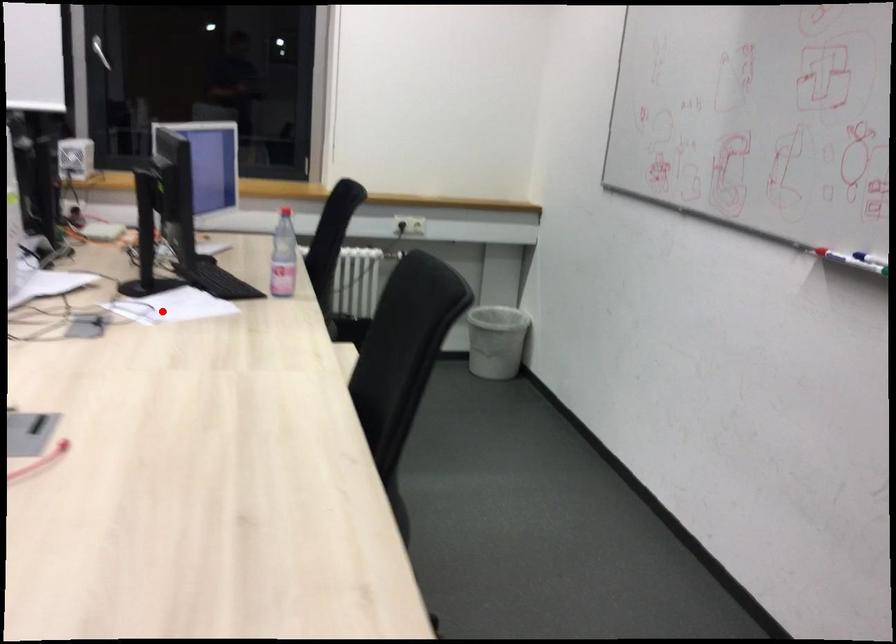
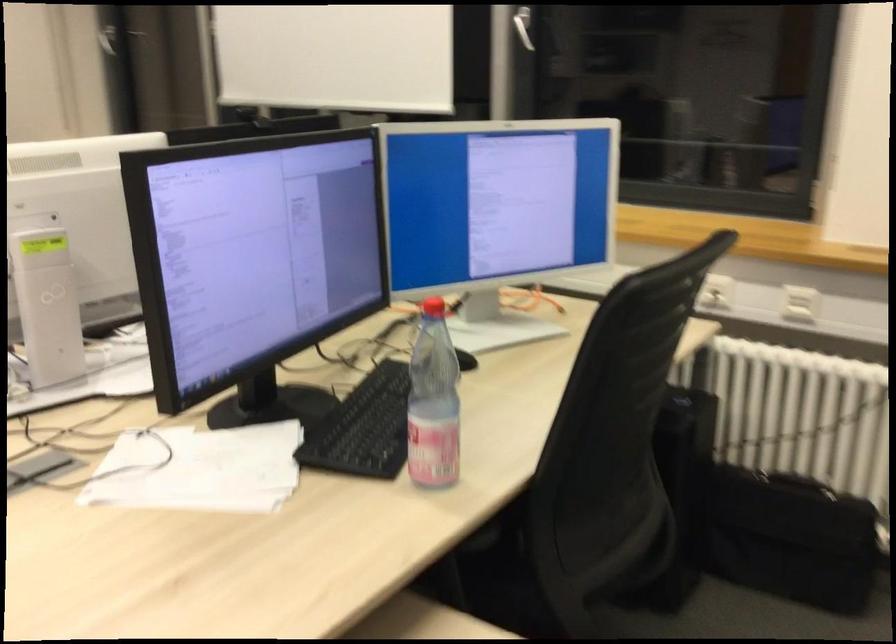
The point at the highlighted location is marked in the first image. Where is the corresponding point in the second image?

(199, 469)